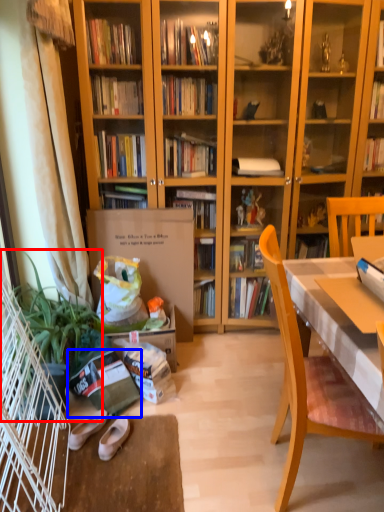
Question: Which point is further to the camera, houseplant (highlighted by a red box) or paperback book (highlighted by a blue box)?

Choices:
 (A) houseplant
 (B) paperback book

Answer: (B)